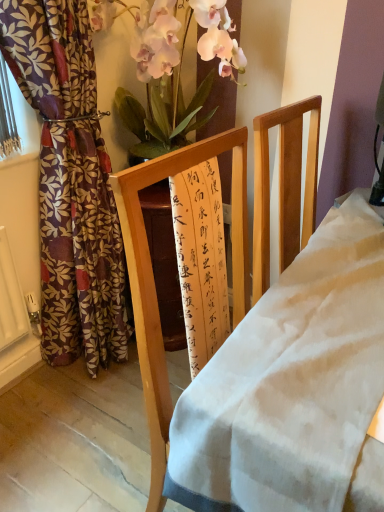
Question: Is floral-patterned fabric curtain at left oriented towards silky pink petals at upper center?

Choices:
 (A) no
 (B) yes

Answer: (A)

Question: From a real-world perspective, is floral-patterned fabric curtain at left over silky pink petals at upper center?

Choices:
 (A) yes
 (B) no

Answer: (B)

Question: From the image's perspective, is floral-patterned fabric curtain at left located above silky pink petals at upper center?

Choices:
 (A) yes
 (B) no

Answer: (B)

Question: Is silky pink petals at upper center completely or partially inside floral-patterned fabric curtain at left?

Choices:
 (A) no
 (B) yes

Answer: (A)

Question: Is floral-patterned fabric curtain at left bigger than silky pink petals at upper center?

Choices:
 (A) no
 (B) yes

Answer: (B)

Question: Is point pyautogui.click(x=195, y=507) closer or farther from the camera than point pyautogui.click(x=86, y=225)?

Choices:
 (A) farther
 (B) closer

Answer: (B)

Question: Relative to floral-patterned fabric curtain at left, is wooden frame at center in front or behind?

Choices:
 (A) behind
 (B) front

Answer: (B)

Question: In terms of size, does wooden frame at center appear bigger or smaller than floral-patterned fabric curtain at left?

Choices:
 (A) small
 (B) big

Answer: (B)

Question: From their relative heights in the image, would you say wooden frame at center is taller or shorter than floral-patterned fabric curtain at left?

Choices:
 (A) short
 (B) tall

Answer: (A)

Question: Considering the positions of silky pink petals at upper center and floral-patterned fabric curtain at left in the image, is silky pink petals at upper center wider or thinner than floral-patterned fabric curtain at left?

Choices:
 (A) wide
 (B) thin

Answer: (A)

Question: Is silky pink petals at upper center in front of or behind floral-patterned fabric curtain at left in the image?

Choices:
 (A) behind
 (B) front

Answer: (A)

Question: Considering the positions of point (157, 17) and point (51, 225), is point (157, 17) closer or farther from the camera than point (51, 225)?

Choices:
 (A) farther
 (B) closer

Answer: (B)

Question: Which is correct: silky pink petals at upper center is inside floral-patterned fabric curtain at left, or outside of it?

Choices:
 (A) inside
 (B) outside

Answer: (B)

Question: From the image's perspective, is floral-patterned fabric curtain at left located above or below silky pink petals at upper center?

Choices:
 (A) below
 (B) above

Answer: (A)

Question: From a real-world perspective, is floral-patterned fabric curtain at left physically located above or below silky pink petals at upper center?

Choices:
 (A) above
 (B) below

Answer: (B)